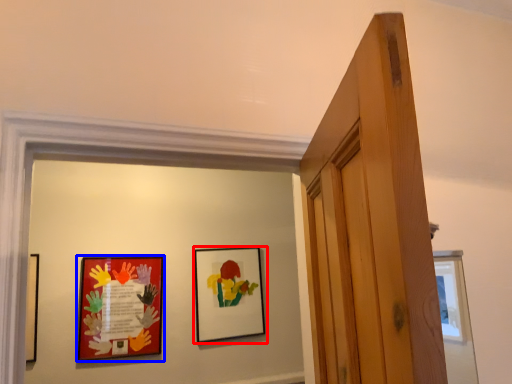
Question: Among these objects, which one is farthest to the camera, picture frame (highlighted by a red box) or picture frame (highlighted by a blue box)?

Choices:
 (A) picture frame
 (B) picture frame

Answer: (A)